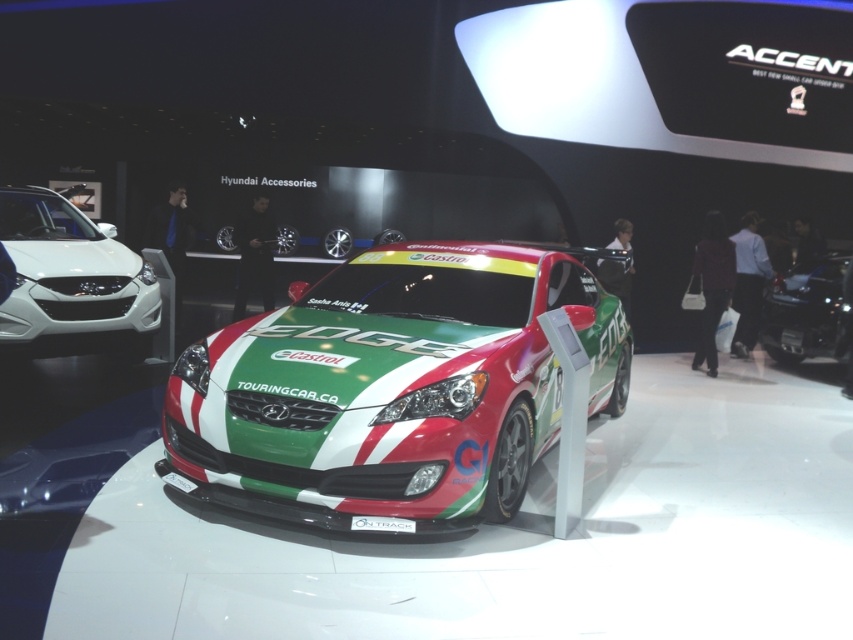
Describe the element at coordinates (392, 387) in the screenshot. I see `shiny metallic race car at center` at that location.

Is point (334, 305) farther from camera compared to point (20, 308)?

No, (334, 305) is in front of (20, 308).

Where is `shiny metallic race car at center`? The height and width of the screenshot is (640, 853). shiny metallic race car at center is located at coordinates (392, 387).

Locate an element on the screen. shiny metallic race car at center is located at coordinates (392, 387).

Is shiny black car at center positioned in front of white plastic license plate at center?

No, shiny black car at center is further to the viewer.

Does shiny black car at center have a smaller size compared to white plastic license plate at center?

No, shiny black car at center is not smaller than white plastic license plate at center.

Does point (799, 284) come closer to viewer compared to point (363, 525)?

No.

The width and height of the screenshot is (853, 640). I want to click on shiny black car at center, so click(x=807, y=312).

Is point (25, 349) positioned behind point (405, 525)?

Yes, it is.

Does white glossy sedan at left appear under white plastic license plate at center?

Incorrect, white glossy sedan at left is not positioned below white plastic license plate at center.

Locate an element on the screen. white glossy sedan at left is located at coordinates (71, 282).